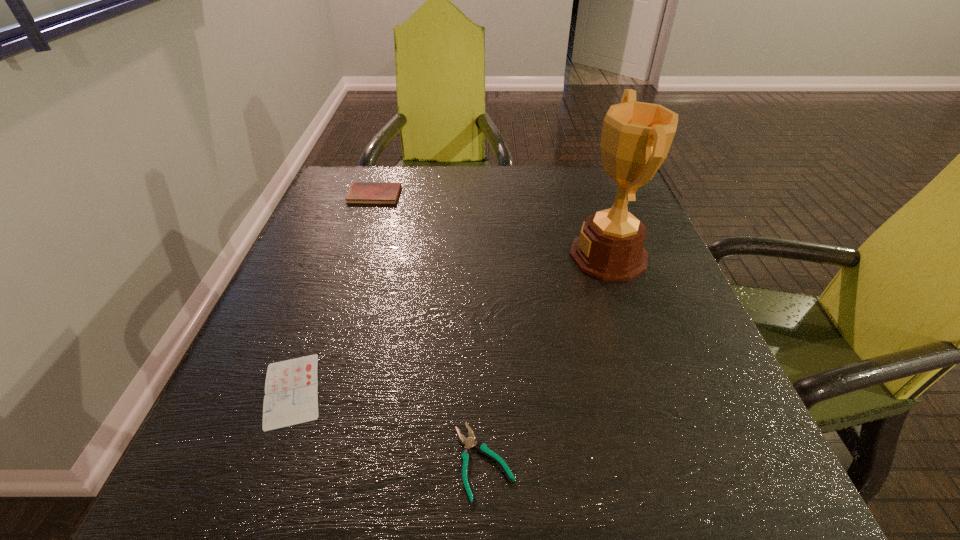
Identify the location of the third nearest object. (636, 137).

Find the location of `award`. award is located at coordinates pyautogui.click(x=636, y=137).

Image resolution: width=960 pixels, height=540 pixels. I want to click on the taller diary, so click(360, 192).

Where is `the farthest object`? This screenshot has height=540, width=960. the farthest object is located at coordinates (360, 192).

This screenshot has width=960, height=540. Identify the location of the nearer diary. click(291, 388).

I want to click on the second object from right to left, so click(x=469, y=442).

This screenshot has height=540, width=960. I want to click on blank area located on the front-facing side of the tallest object, so click(x=415, y=256).

Where is `free space located 0.200m on the front-facing side of the tallest object`? The height and width of the screenshot is (540, 960). free space located 0.200m on the front-facing side of the tallest object is located at coordinates (478, 256).

At what (x,y) coordinates should I click in order to perform the action: click on free space located 0.390m on the front-facing side of the tallest object. Please return your answer as a coordinate pair (x, y). Looking at the image, I should click on (392, 256).

At what (x,y) coordinates should I click in order to perform the action: click on free space located 0.150m on the right of the farthest object. Please return your answer as a coordinate pair (x, y). This screenshot has width=960, height=540. Looking at the image, I should click on (457, 195).